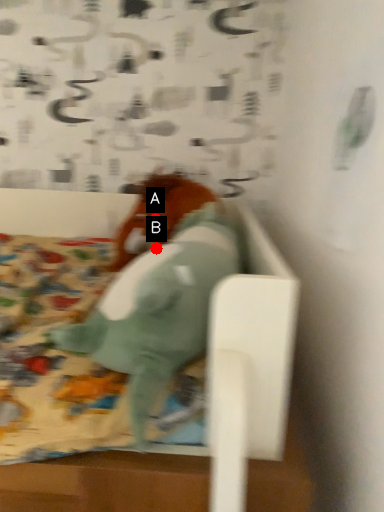
Question: Two points are circled on the image, labeled by A and B beside each circle. Which point is closer to the camera?

Choices:
 (A) A is closer
 (B) B is closer

Answer: (B)